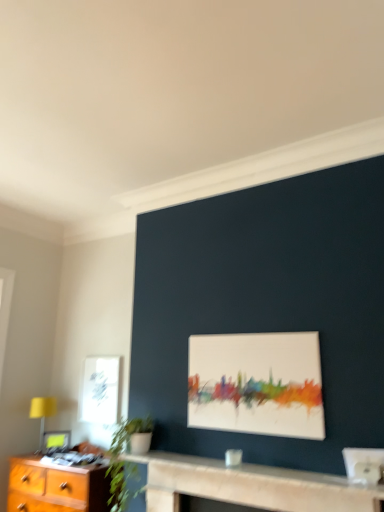
Question: Is white matte painting at center, arranged as the first picture frame when viewed from the top, bigger or smaller than white paper at upper left?

Choices:
 (A) big
 (B) small

Answer: (A)

Question: Is white matte painting at center, arranged as the first picture frame when viewed from the top, wider or thinner than white paper at upper left?

Choices:
 (A) wide
 (B) thin

Answer: (A)

Question: Which of these objects is positioned closest to the matte black picture frame at lower left, arranged as the first picture frame when ordered from the bottom?

Choices:
 (A) green leafy plant at lower left
 (B) smooth stone fireplace at center
 (C) white matte painting at center, marked as the 1th picture frame in a right-to-left arrangement
 (D) white paper at upper left
 (E) yellow fabric lampshade at left

Answer: (E)

Question: Which is nearer to the green leafy plant at lower left?

Choices:
 (A) smooth stone fireplace at center
 (B) white paper at upper left
 (C) white matte painting at center, arranged as the 2th picture frame when viewed from the back
 (D) yellow fabric lampshade at left
 (E) matte black picture frame at lower left, marked as the second picture frame in a top-to-bottom arrangement

Answer: (A)